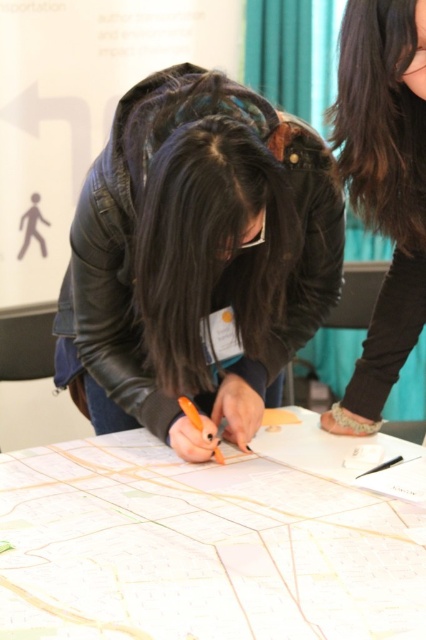
You are a participant in the conference and need to reach the white paper map at center to make a note. However, the leather jacket at center is in your way. Can you easily access the map without disturbing the person wearing the jacket?

The leather jacket at center is located above the white paper map at center, so the person wearing the jacket is likely sitting or leaning over the map. This means the jacket is directly blocking access to the map, making it difficult to reach without disturbing them.

You are organizing a workshop and need to ensure that the white paper map at center is visible to everyone. Considering the black leather jacket at upper right, what might be an issue with visibility?

The white paper map at center is not as tall as the black leather jacket at upper right, so the jacket might block the view of the map for some participants.

You are a conference attendee who wants to see the map clearly. The white paper map at center is partially covered by the black leather jacket at upper right. Can you move the jacket to the right to get a better view?

The white paper map at center is to the left of the black leather jacket at upper right, so moving the jacket to the right would reveal more of the map.